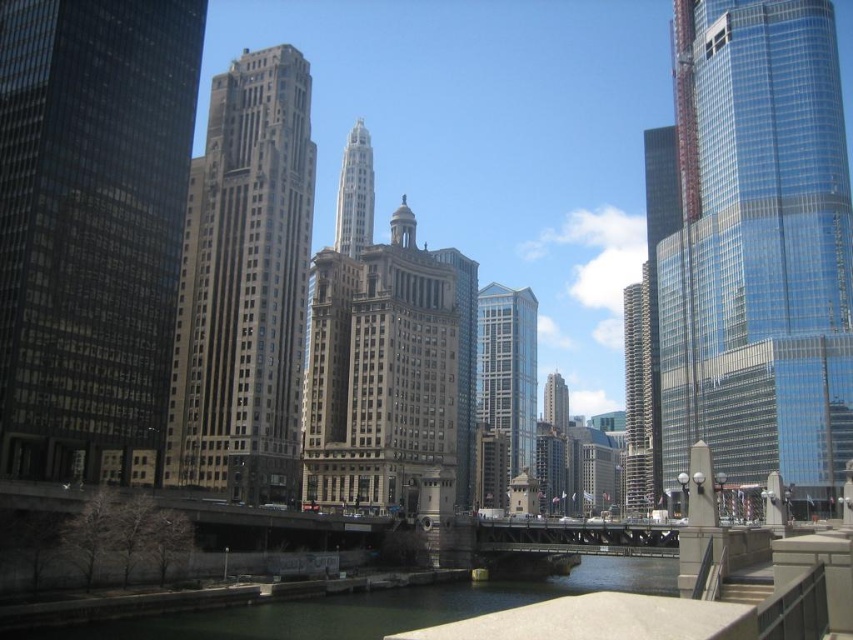
Question: Can you confirm if beige stone building at center is positioned above glassy reflective skyscraper at center?

Choices:
 (A) no
 (B) yes

Answer: (B)

Question: Does green concrete river at lower center have a smaller size compared to gray stone tower at center?

Choices:
 (A) yes
 (B) no

Answer: (B)

Question: Is matte glass skyscraper at left bigger than glassy reflective skyscraper at center?

Choices:
 (A) no
 (B) yes

Answer: (A)

Question: Which object appears farthest from the camera in this image?

Choices:
 (A) glassy reflective skyscraper at right
 (B) gray stone tower at center

Answer: (A)

Question: Which of the following is the farthest from the observer?

Choices:
 (A) transparent glass skyscraper at right
 (B) green concrete river at lower center
 (C) matte glass skyscraper at left

Answer: (C)

Question: Which of these objects is positioned farthest from the glassy reflective skyscraper at right?

Choices:
 (A) gray stone tower at center
 (B) transparent glass skyscraper at right
 (C) gold textured building at center
 (D) green concrete river at lower center

Answer: (C)